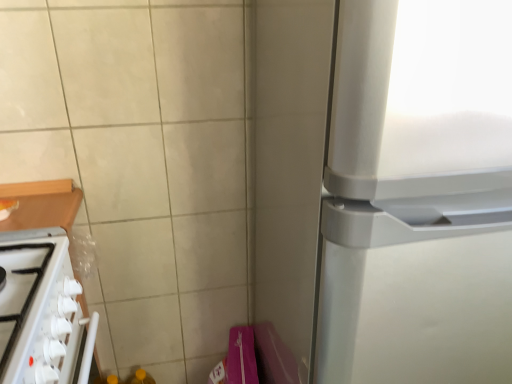
Question: In the image, is white glossy stove at lower left on the left side or the right side of satin silver refrigerator at right?

Choices:
 (A) right
 (B) left

Answer: (B)

Question: From a real-world perspective, is white glossy stove at lower left above or below satin silver refrigerator at right?

Choices:
 (A) below
 (B) above

Answer: (A)

Question: Considering the positions of white glossy stove at lower left and satin silver refrigerator at right in the image, is white glossy stove at lower left wider or thinner than satin silver refrigerator at right?

Choices:
 (A) wide
 (B) thin

Answer: (B)

Question: Is satin silver refrigerator at right in front of or behind white glossy stove at lower left in the image?

Choices:
 (A) front
 (B) behind

Answer: (A)

Question: From the image's perspective, is satin silver refrigerator at right above or below white glossy stove at lower left?

Choices:
 (A) above
 (B) below

Answer: (A)

Question: Is satin silver refrigerator at right taller or shorter than white glossy stove at lower left?

Choices:
 (A) short
 (B) tall

Answer: (B)

Question: From a real-world perspective, relative to white glossy stove at lower left, is satin silver refrigerator at right vertically above or below?

Choices:
 (A) below
 (B) above

Answer: (B)